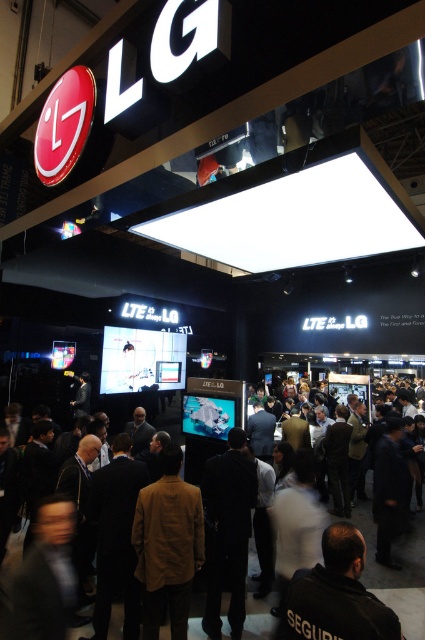
You are an event organizer at the LG booth and need to ensure that all attendees can see the LED panel. The brown leather jacket at center and dark gray clothing at center are blocking the view. Which attendee should you ask to move first to improve visibility?

The brown leather jacket at center is taller than dark gray clothing at center, so you should ask the attendee wearing the brown leather jacket at center to move first to improve visibility.

You are an event organizer at the LG booth. You need to ensure that the black leather jacket at lower center and the dark gray clothing at center can hear each other when speaking. Given that the minimum distance for clear conversation without amplification is 3 meters, can they converse comfortably without needing to raise their voices?

The black leather jacket at lower center and the dark gray clothing at center are 3.63 meters apart from each other, which exceeds the 3 meter minimum distance required for clear conversation without amplification. Therefore, they can converse comfortably without needing to raise their voices.